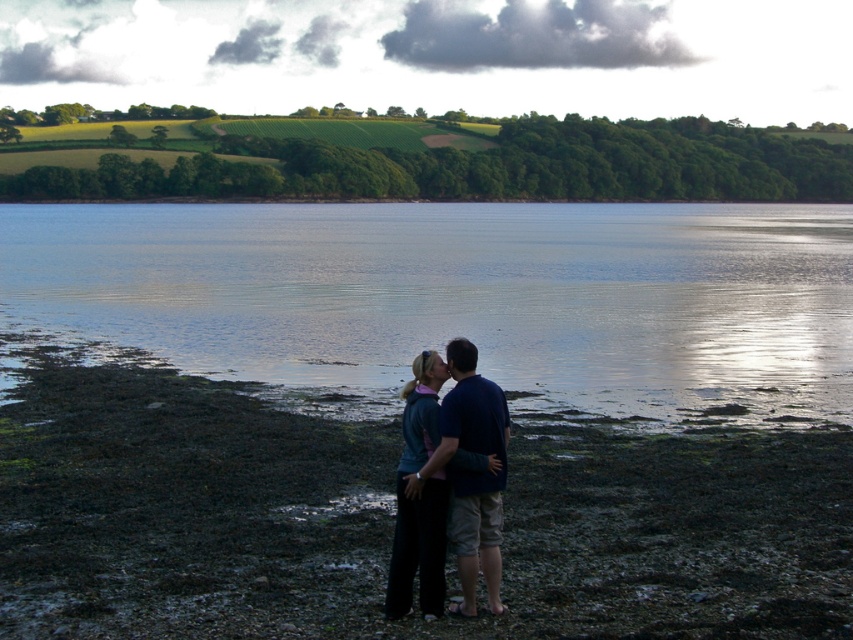
You are standing at point (332,467) and want to walk towards the two people in the lakeside scene. Which direction should you go to reach them first?

Since the two people are 13.56 meters apart, you should go towards the one that is closer to your current position at point (332,467).

You are standing at the point labeled point [636,513] and want to walk to the point labeled point [323,218]. Which direction should you move to get closer to your destination?

You should move away from the viewer because point [323,218] is further away from the viewer compared to point [636,513].